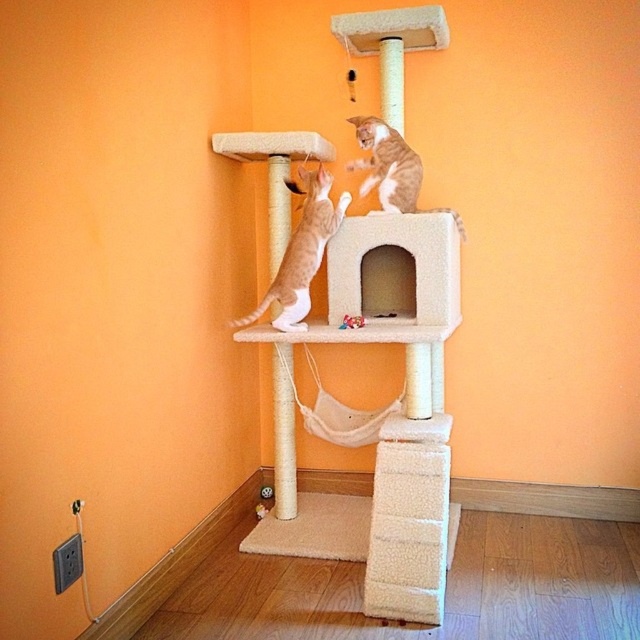
You are standing 2 meters away from the orange fur cat at center. Can you reach the cat with a 1.5 meter long fishing rod? Please explain your reasoning.

The orange fur cat at center is 2.37 meters away from the camera. Since you are standing 2 meters away from the cat, the total distance between you and the cat is 2 meters. With a 1.5 meter long fishing rod, you cannot reach the cat because the rod is shorter than the distance between you and the cat.

You are a cat owner trying to locate your two cats. You see an orange fur cat at center and an orange fur cat at upper center. Which cat is closer to you?

The orange fur cat at center is closer to you because it is in front of the orange fur cat at upper center.

You are a cat owner who wants to ensure both cats have enough space on the cat tree. Based on the image, which orange fur cat has a smaller size between the orange fur cat at center and the orange fur cat at upper center?

The orange fur cat at center has a lesser width compared to orange fur cat at upper center, so it is smaller in size.